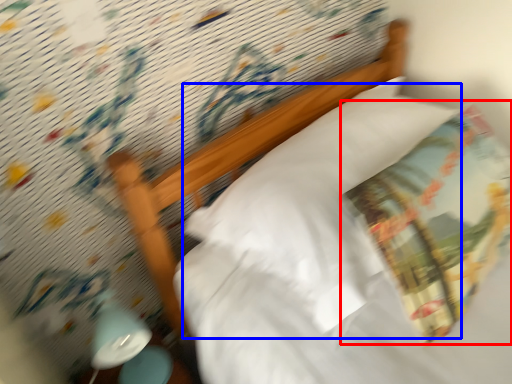
Question: Which point is further to the camera, throw pillow (highlighted by a red box) or pillow (highlighted by a blue box)?

Choices:
 (A) throw pillow
 (B) pillow

Answer: (B)